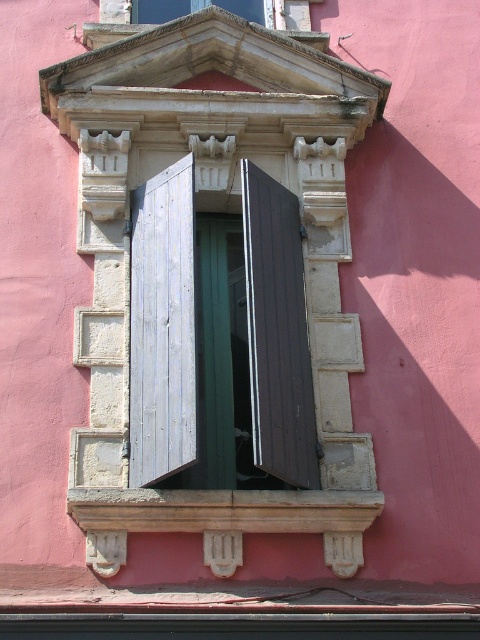
Is light gray wood shutter at left positioned before brown wooden shutter at center?

That is False.

Does light gray wood shutter at left appear on the left side of brown wooden shutter at center?

Result: Yes, light gray wood shutter at left is to the left of brown wooden shutter at center.

Between point (194, 390) and point (271, 241), which one is positioned in front?

Point (194, 390) is in front.

Image resolution: width=480 pixels, height=640 pixels. I want to click on light gray wood shutter at left, so click(163, 326).

Does light gray wood shutter at left have a greater width compared to wooden shutters at upper center?

Yes.

Can you confirm if light gray wood shutter at left is taller than wooden shutters at upper center?

Yes.

I want to click on light gray wood shutter at left, so click(163, 326).

You are a GUI agent. You are given a task and a screenshot of the screen. Output one action in this format:
    pyautogui.click(x=<x>, y=<y>)
    Task: Click on the light gray wood shutter at left
    
    Given the screenshot: What is the action you would take?
    pyautogui.click(x=163, y=326)

Between brown wooden shutter at center and wooden shutters at upper center, which one appears on the left side from the viewer's perspective?

Positioned to the left is wooden shutters at upper center.

From the picture: Which is below, brown wooden shutter at center or wooden shutters at upper center?

brown wooden shutter at center

At what (x,y) coordinates should I click in order to perform the action: click on brown wooden shutter at center. Please return your answer as a coordinate pair (x, y). This screenshot has width=480, height=640. Looking at the image, I should click on (277, 332).